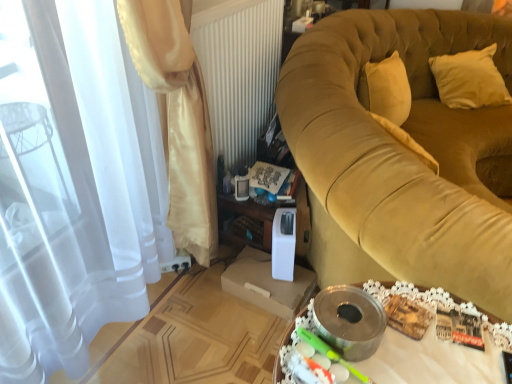
Measure the distance between velvet gold couch at right and camera.

velvet gold couch at right is 36.48 inches from camera.

What do you see at coordinates (469, 79) in the screenshot? This screenshot has height=384, width=512. I see `beige fabric pillow at upper right` at bounding box center [469, 79].

What are the coordinates of `velvet gold couch at right` in the screenshot? It's located at (405, 154).

From the image's perspective, is beige fabric pillow at upper right under satin curtain at left, which ranks as the 1th curtain in front-to-back order?

No, from the image's perspective, beige fabric pillow at upper right is not below satin curtain at left, which ranks as the 1th curtain in front-to-back order.

Between beige fabric pillow at upper right and satin curtain at left, which ranks as the 1th curtain in front-to-back order, which one appears on the left side from the viewer's perspective?

satin curtain at left, which ranks as the 1th curtain in front-to-back order, is more to the left.

Considering the sizes of objects beige fabric pillow at upper right and satin curtain at left, which ranks as the 1th curtain in front-to-back order, in the image provided, who is smaller, beige fabric pillow at upper right or satin curtain at left, which ranks as the 1th curtain in front-to-back order,?

beige fabric pillow at upper right.

Starting from the beige fabric pillow at upper right, which curtain is the 2nd one to the left? Please provide its 2D coordinates.

[(72, 185)]

From their relative heights in the image, would you say velvet gold couch at right is taller or shorter than satin curtain at left, the second curtain positioned from the front?

velvet gold couch at right is shorter than satin curtain at left, the second curtain positioned from the front.

Is velvet gold couch at right completely or partially outside of satin curtain at left, which appears as the 1th curtain when viewed from the back?

That's correct, velvet gold couch at right is outside of satin curtain at left, which appears as the 1th curtain when viewed from the back.

From the image's perspective, is velvet gold couch at right on top of satin curtain at left, which appears as the 1th curtain when viewed from the back?

No, from the image's perspective, velvet gold couch at right is not above satin curtain at left, which appears as the 1th curtain when viewed from the back.

Is point (403, 273) less distant than point (175, 48)?

Yes, point (403, 273) is in front of point (175, 48).

Is satin curtain at left, the second curtain when ordered from back to front, oriented away from beige fabric pillow at upper right?

No, satin curtain at left, the second curtain when ordered from back to front, is not facing the opposite direction of beige fabric pillow at upper right.

From a real-world perspective, is satin curtain at left, which ranks as the 1th curtain in front-to-back order, physically located above or below beige fabric pillow at upper right?

satin curtain at left, which ranks as the 1th curtain in front-to-back order, is above beige fabric pillow at upper right.

Is satin curtain at left, which ranks as the 1th curtain in front-to-back order, positioned far away from beige fabric pillow at upper right?

That's right, there is a large distance between satin curtain at left, which ranks as the 1th curtain in front-to-back order, and beige fabric pillow at upper right.

How different are the orientations of satin curtain at left, which ranks as the 1th curtain in front-to-back order, and beige fabric pillow at upper right in degrees?

There is a 54.1-degree angle between the facing directions of satin curtain at left, which ranks as the 1th curtain in front-to-back order, and beige fabric pillow at upper right.

How many degrees apart are the facing directions of metallic silver tray at lower center and beige fabric pillow at upper right?

The facing directions of metallic silver tray at lower center and beige fabric pillow at upper right are 54.1 degrees apart.

Is point (489, 332) closer to camera compared to point (482, 102)?

Yes.

From a real-world perspective, is metallic silver tray at lower center physically located above or below beige fabric pillow at upper right?

In terms of real-world spatial position, metallic silver tray at lower center is below beige fabric pillow at upper right.

Where is `table beneath the satin curtain at left, the second curtain positioned from the front (from a real-world perspective)`? table beneath the satin curtain at left, the second curtain positioned from the front (from a real-world perspective) is located at coordinates (440, 305).

Who is shorter, metallic silver tray at lower center or satin curtain at left, the second curtain positioned from the front?

Standing shorter between the two is metallic silver tray at lower center.

Is metallic silver tray at lower center positioned far away from satin curtain at left, which appears as the 1th curtain when viewed from the back?

No, metallic silver tray at lower center is in close proximity to satin curtain at left, which appears as the 1th curtain when viewed from the back.

Is metallic silver tray at lower center positioned with its back to satin curtain at left, the second curtain positioned from the front?

No, metallic silver tray at lower center's orientation is not away from satin curtain at left, the second curtain positioned from the front.

From a real-world perspective, is satin curtain at left, the second curtain when ordered from back to front, above or below satin curtain at left, which appears as the 1th curtain when viewed from the back?

satin curtain at left, the second curtain when ordered from back to front, is situated higher than satin curtain at left, which appears as the 1th curtain when viewed from the back, in the real world.

Based on the photo, is satin curtain at left, the second curtain when ordered from back to front, far away from satin curtain at left, the second curtain positioned from the front?

That's not correct — satin curtain at left, the second curtain when ordered from back to front, is a little close to satin curtain at left, the second curtain positioned from the front.

Which object is closer to the camera taking this photo, satin curtain at left, the second curtain when ordered from back to front, or satin curtain at left, which appears as the 1th curtain when viewed from the back?

Positioned in front is satin curtain at left, the second curtain when ordered from back to front.

Is satin curtain at left, which ranks as the 1th curtain in front-to-back order, oriented away from satin curtain at left, which appears as the 1th curtain when viewed from the back?

That's right, satin curtain at left, which ranks as the 1th curtain in front-to-back order, is facing away from satin curtain at left, which appears as the 1th curtain when viewed from the back.

Is satin curtain at left, the second curtain positioned from the front, aimed at velvet gold couch at right?

Yes.

From a real-world perspective, is satin curtain at left, which appears as the 1th curtain when viewed from the back, positioned over velvet gold couch at right based on gravity?

Correct, in the physical world, satin curtain at left, which appears as the 1th curtain when viewed from the back, is higher than velvet gold couch at right.

Which is closer to the camera, (155, 2) or (346, 79)?

The point (155, 2) is more forward.

I want to click on pillow lying on the right of satin curtain at left, the second curtain when ordered from back to front, so click(x=469, y=79).

At what (x,y) coordinates should I click in order to perform the action: click on curtain above the velvet gold couch at right (from the image's perspective). Please return your answer as a coordinate pair (x, y). This screenshot has height=384, width=512. Looking at the image, I should click on (177, 117).

When comparing their distances from metallic silver tray at lower center, does beige fabric pillow at upper right or satin curtain at left, which appears as the 1th curtain when viewed from the back, seem further?

beige fabric pillow at upper right is positioned further to the anchor metallic silver tray at lower center.

From the image, which object appears to be farther from metallic silver tray at lower center, beige fabric pillow at upper right or velvet gold couch at right?

Based on the image, beige fabric pillow at upper right appears to be further to metallic silver tray at lower center.

Looking at the image, which one is located further to satin curtain at left, the second curtain positioned from the front, metallic silver tray at lower center or velvet gold couch at right?

metallic silver tray at lower center is positioned further to the anchor satin curtain at left, the second curtain positioned from the front.

From the image, which object appears to be nearer to satin curtain at left, which appears as the 1th curtain when viewed from the back, metallic silver tray at lower center or beige fabric pillow at upper right?

metallic silver tray at lower center lies closer to satin curtain at left, which appears as the 1th curtain when viewed from the back, than the other object.

Estimate the real-world distances between objects in this image. Which object is further from beige fabric pillow at upper right, metallic silver tray at lower center or satin curtain at left, which appears as the 1th curtain when viewed from the back?

metallic silver tray at lower center is further to beige fabric pillow at upper right.

Considering their positions, is satin curtain at left, the second curtain when ordered from back to front, positioned closer to beige fabric pillow at upper right than metallic silver tray at lower center?

The object closer to beige fabric pillow at upper right is metallic silver tray at lower center.

Estimate the real-world distances between objects in this image. Which object is further from satin curtain at left, which appears as the 1th curtain when viewed from the back, velvet gold couch at right or metallic silver tray at lower center?

Based on the image, metallic silver tray at lower center appears to be further to satin curtain at left, which appears as the 1th curtain when viewed from the back.

In the scene shown: From the image, which object appears to be farther from satin curtain at left, the second curtain when ordered from back to front, satin curtain at left, which appears as the 1th curtain when viewed from the back, or velvet gold couch at right?

velvet gold couch at right is further to satin curtain at left, the second curtain when ordered from back to front.

At what (x,y) coordinates should I click in order to perform the action: click on furniture between metallic silver tray at lower center and beige fabric pillow at upper right along the z-axis. Please return your answer as a coordinate pair (x, y). Looking at the image, I should click on (405, 154).

In order to click on curtain between satin curtain at left, which ranks as the 1th curtain in front-to-back order, and beige fabric pillow at upper right in this screenshot , I will do `click(177, 117)`.

Identify the location of furniture between satin curtain at left, the second curtain positioned from the front, and metallic silver tray at lower center vertically. The image size is (512, 384). (405, 154).

This screenshot has width=512, height=384. Identify the location of table between satin curtain at left, which ranks as the 1th curtain in front-to-back order, and velvet gold couch at right. (440, 305).